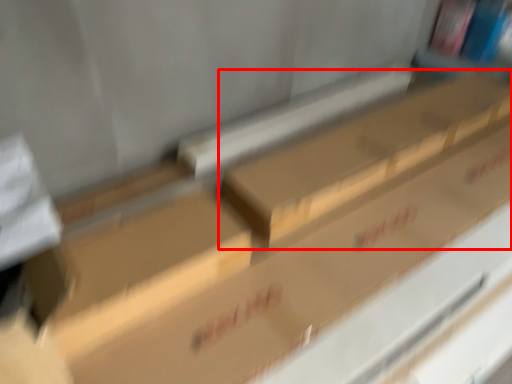
Question: From the image's perspective, where is box (annotated by the red box) located relative to block?

Choices:
 (A) below
 (B) above

Answer: (B)